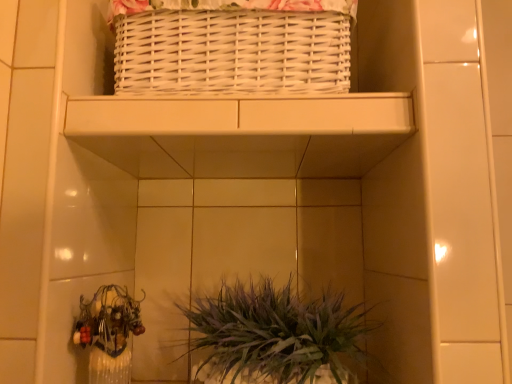
Locate an element on the screen. white wicker basket at upper center is located at coordinates (240, 114).

Describe the element at coordinates (240, 114) in the screenshot. I see `white wicker basket at upper center` at that location.

You are a GUI agent. You are given a task and a screenshot of the screen. Output one action in this format:
    pyautogui.click(x=<x>, y=<y>)
    Task: Click on the white wicker basket at upper center
    
    Given the screenshot: What is the action you would take?
    pyautogui.click(x=240, y=114)